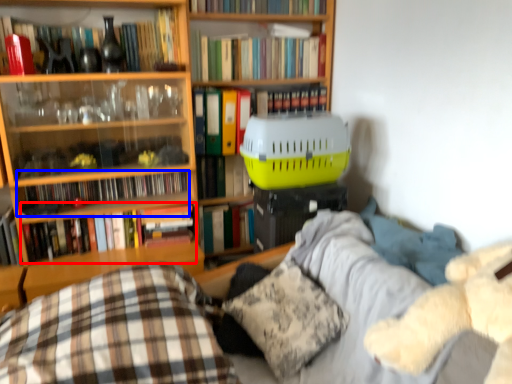
Question: Which point is closer to the camera, book (highlighted by a red box) or book (highlighted by a blue box)?

Choices:
 (A) book
 (B) book

Answer: (A)